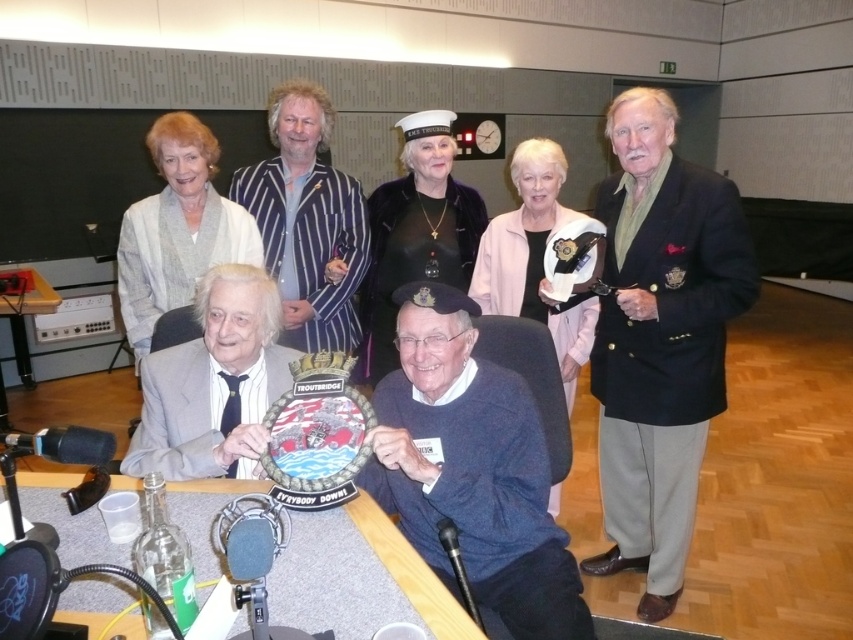
Question: Is wooden table at center above white woolen cardigan at upper left?

Choices:
 (A) yes
 (B) no

Answer: (B)

Question: Which of these objects is positioned closest to the wooden table at center?

Choices:
 (A) wooden table at lower left
 (B) white woolen cardigan at upper left

Answer: (B)

Question: Can you confirm if striped fabric jacket at upper center is positioned to the right of black velvet dress at center?

Choices:
 (A) yes
 (B) no

Answer: (B)

Question: Which of the following is the farthest from the observer?

Choices:
 (A) blue wool sweater at center
 (B) dark blue woolen blazer at right

Answer: (B)

Question: Is dark blue woolen blazer at right bigger than wooden table at center?

Choices:
 (A) yes
 (B) no

Answer: (A)

Question: Which object is closer to the camera taking this photo?

Choices:
 (A) gray fabric suit at lower left
 (B) pink fabric jacket at upper center

Answer: (A)